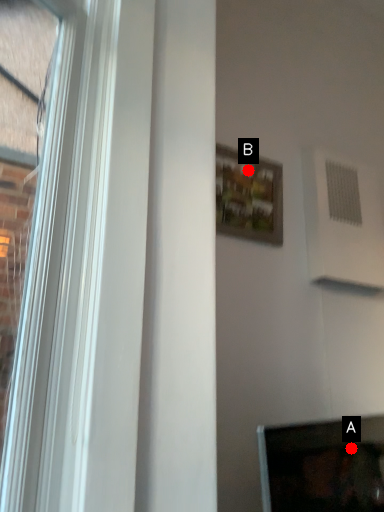
Question: Two points are circled on the image, labeled by A and B beside each circle. Which point is closer to the camera?

Choices:
 (A) A is closer
 (B) B is closer

Answer: (B)